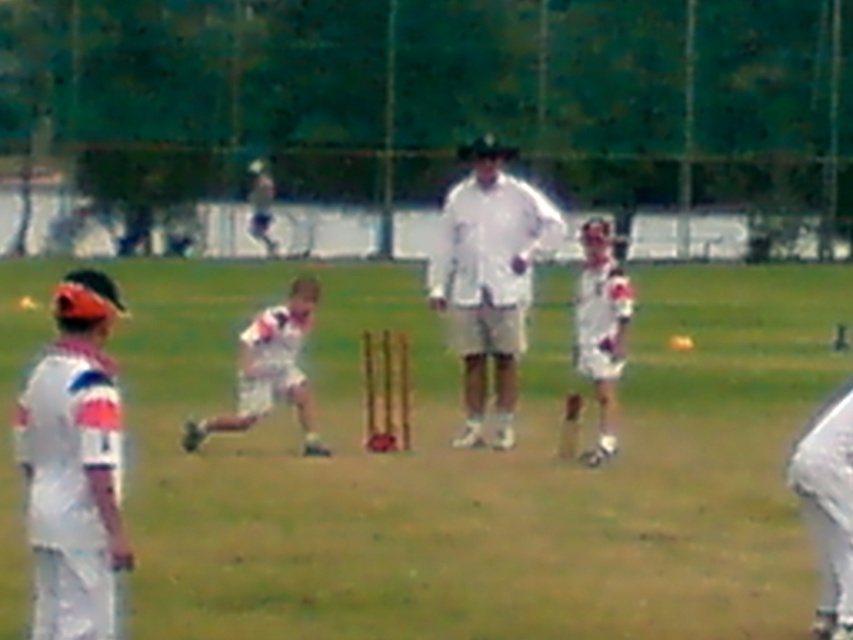
Is point (260, 397) closer to camera compared to point (621, 282)?

No, (260, 397) is behind (621, 282).

Looking at this image, is white cotton shirt at center wider than white fabric shirt at center?

→ Indeed, white cotton shirt at center has a greater width compared to white fabric shirt at center.

In the scene shown: Measure the distance between point (251, 332) and camera.

Point (251, 332) and camera are 17.98 meters apart.

Find the location of a particular element. The width and height of the screenshot is (853, 640). white cotton shirt at center is located at coordinates point(270,369).

Which of these two, white fabric uniform at center or white matte shirt at center, stands taller?

Standing taller between the two is white matte shirt at center.

Is point (267, 538) positioned in front of point (491, 352)?

Yes, it is.

Find the location of a particular element. white fabric uniform at center is located at coordinates (476, 465).

Between point (404, 314) and point (581, 342), which one is positioned behind?

The point (404, 314) is behind.

Who is more forward, (648, 410) or (585, 339)?

Positioned in front is point (585, 339).

Where is `white fabric uniform at center`? white fabric uniform at center is located at coordinates (476, 465).